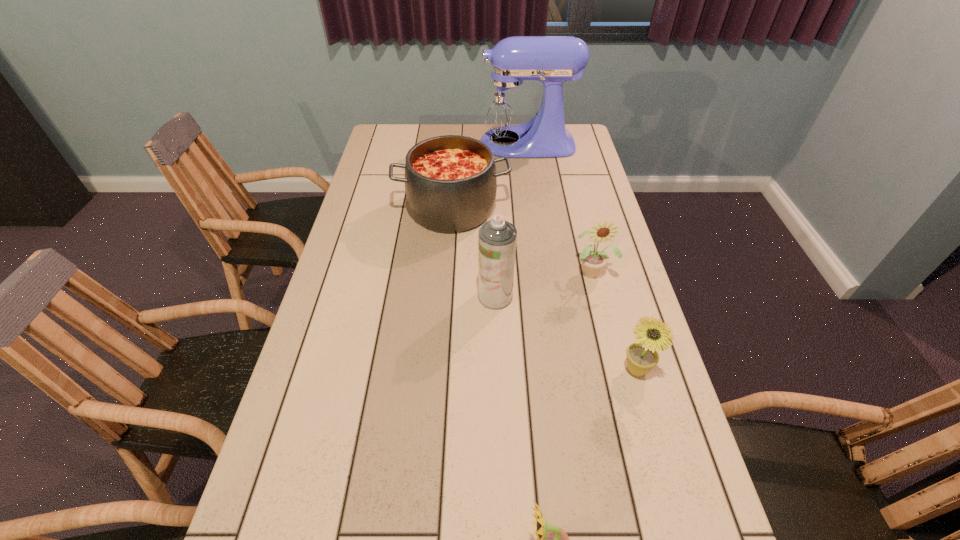
Find the location of a particular element. This screenshot has width=960, height=540. the farthest object is located at coordinates (506, 105).

Image resolution: width=960 pixels, height=540 pixels. I want to click on mixer, so click(x=506, y=105).

Find the location of a particular element. The width and height of the screenshot is (960, 540). the second tallest object is located at coordinates (497, 238).

The width and height of the screenshot is (960, 540). Find the location of `the farthest sunflower`. the farthest sunflower is located at coordinates (592, 260).

Find the location of `the second farthest object`. the second farthest object is located at coordinates (450, 181).

Identify the location of the fifth farthest object. The image size is (960, 540). (642, 356).

Where is `vacant area located 0.070m at the mixing area of the tallest object`? This screenshot has height=540, width=960. vacant area located 0.070m at the mixing area of the tallest object is located at coordinates (456, 143).

What are the coordinates of `vacant space situated at the mixing area of the tallest object` in the screenshot? It's located at (382, 143).

Where is `vacant region located at the mixing area of the tallest object`? vacant region located at the mixing area of the tallest object is located at coordinates (426, 143).

Where is `vacant space located 0.290m on the front of the second tallest object`? vacant space located 0.290m on the front of the second tallest object is located at coordinates (499, 410).